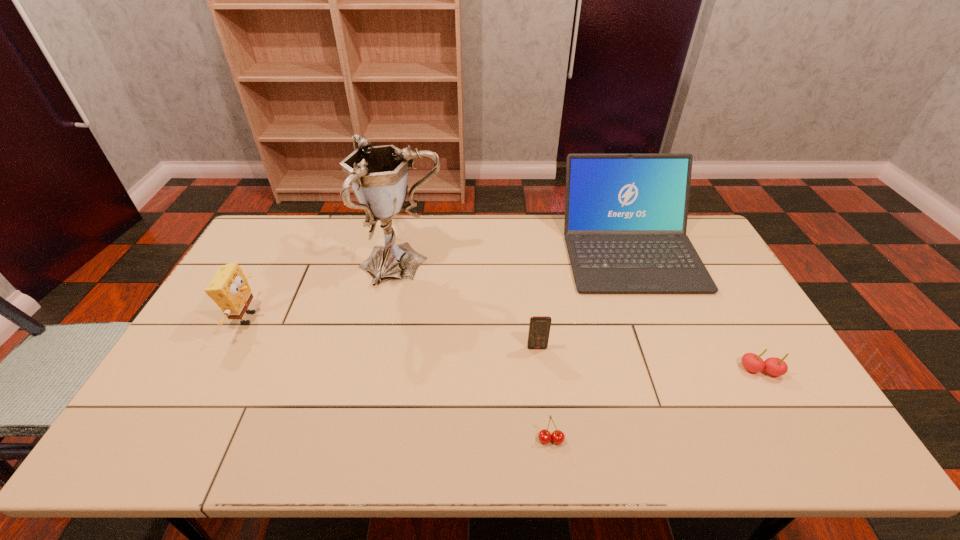
You are a GUI agent. You are given a task and a screenshot of the screen. Output one action in this format:
    pyautogui.click(x=<x>, y=<y>)
    Task: Click on the tallest object
    
    Given the screenshot: What is the action you would take?
    pyautogui.click(x=378, y=175)

Locate an element on the screen. The height and width of the screenshot is (540, 960). trophy cup is located at coordinates (378, 175).

The width and height of the screenshot is (960, 540). In order to click on laptop computer in this screenshot , I will do `click(625, 225)`.

Image resolution: width=960 pixels, height=540 pixels. Find the location of `the leftmost object`. the leftmost object is located at coordinates (229, 289).

Image resolution: width=960 pixels, height=540 pixels. Find the location of `the third tallest object`. the third tallest object is located at coordinates (229, 289).

Identify the location of the fourth tallest object. This screenshot has height=540, width=960. coord(539,327).

Image resolution: width=960 pixels, height=540 pixels. I want to click on the fifth farthest object, so click(754, 363).

At what (x,y) coordinates should I click in order to perform the action: click on the farther cherry. Please return your answer as a coordinate pair (x, y). Looking at the image, I should click on (754, 363).

Identify the location of the nearest object. [545, 436].

Identify the location of the nearer cherry. (545, 436).